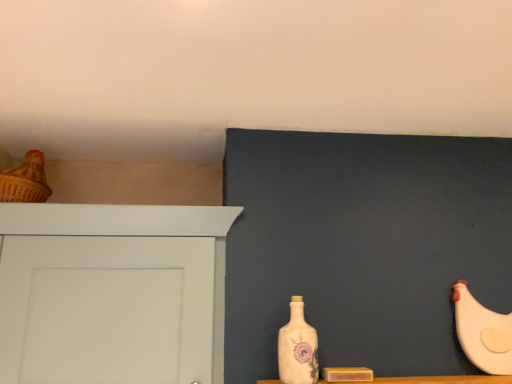
How much space does matte brown chicken at upper left, acting as the 2th chicken starting from the bottom, occupy horizontally?

6.15 inches.

Locate an element on the screen. white painted wood door at left is located at coordinates (110, 292).

You are a GUI agent. You are given a task and a screenshot of the screen. Output one action in this format:
    pyautogui.click(x=<x>, y=<y>)
    Task: Click on the matte brown chicken at upper left, arranged as the 2th chicken when viewed from the right
    
    Given the screenshot: What is the action you would take?
    pyautogui.click(x=25, y=181)

Looking at this image, considering the sizes of objects porcelain floral bottle at center and white painted wood door at left in the image provided, who is taller, porcelain floral bottle at center or white painted wood door at left?

Standing taller between the two is white painted wood door at left.

In the scene shown: Considering the relative positions of porcelain floral bottle at center and white painted wood door at left in the image provided, is porcelain floral bottle at center to the left or to the right of white painted wood door at left?

porcelain floral bottle at center is positioned on white painted wood door at left's right side.

From the image's perspective, relative to white painted wood door at left, is porcelain floral bottle at center above or below?

porcelain floral bottle at center is below white painted wood door at left.

In the scene shown: Is the surface of matte brown chicken at upper left, acting as the 2th chicken starting from the bottom, in direct contact with white matte chicken at right, the 2th chicken in the top-to-bottom sequence?

No.

Looking at this image, from the image's perspective, does matte brown chicken at upper left, acting as the 2th chicken starting from the bottom, appear higher than white matte chicken at right, which is the 1th chicken in right-to-left order?

Indeed, from the image's perspective, matte brown chicken at upper left, acting as the 2th chicken starting from the bottom, is shown above white matte chicken at right, which is the 1th chicken in right-to-left order.

This screenshot has width=512, height=384. I want to click on chicken that is on the right side of matte brown chicken at upper left, arranged as the 2th chicken when viewed from the right, so click(x=482, y=332).

How different are the orientations of matte brown chicken at upper left, arranged as the 2th chicken when viewed from the right, and white matte chicken at right, arranged as the first chicken when ordered from the bottom, in degrees?

0.49 degrees separate the facing orientations of matte brown chicken at upper left, arranged as the 2th chicken when viewed from the right, and white matte chicken at right, arranged as the first chicken when ordered from the bottom.

From a real-world perspective, is white matte chicken at right, which is the 1th chicken in right-to-left order, physically located above or below matte brown chicken at upper left, arranged as the 2th chicken when viewed from the right?

white matte chicken at right, which is the 1th chicken in right-to-left order, is below matte brown chicken at upper left, arranged as the 2th chicken when viewed from the right.

Which is nearer, [495,366] or [26,197]?

Positioned in front is point [495,366].

Would you say white matte chicken at right, arranged as the first chicken when ordered from the bottom, is a long distance from matte brown chicken at upper left, which appears as the 1th chicken when viewed from the top?

Absolutely, white matte chicken at right, arranged as the first chicken when ordered from the bottom, is distant from matte brown chicken at upper left, which appears as the 1th chicken when viewed from the top.

Is porcelain floral bottle at center oriented away from matte brown chicken at upper left, arranged as the 2th chicken when viewed from the right?

No.

Considering the relative sizes of porcelain floral bottle at center and matte brown chicken at upper left, acting as the 2th chicken starting from the bottom, in the image provided, is porcelain floral bottle at center bigger than matte brown chicken at upper left, acting as the 2th chicken starting from the bottom,?

Actually, porcelain floral bottle at center might be smaller than matte brown chicken at upper left, acting as the 2th chicken starting from the bottom.

From the image's perspective, is porcelain floral bottle at center under matte brown chicken at upper left, which appears as the 1th chicken when viewed from the top?

Indeed, from the image's perspective, porcelain floral bottle at center is shown beneath matte brown chicken at upper left, which appears as the 1th chicken when viewed from the top.

Looking at this image, who is taller, porcelain floral bottle at center or matte brown chicken at upper left, which ranks as the 1th chicken in left-to-right order?

Standing taller between the two is porcelain floral bottle at center.

From the image's perspective, between white matte chicken at right, the 2th chicken in the top-to-bottom sequence, and white painted wood door at left, which one is located above?

white painted wood door at left appears higher in the image.

This screenshot has width=512, height=384. I want to click on the 1st chicken behind when counting from the white painted wood door at left, so click(482, 332).

Is white matte chicken at right, arranged as the first chicken when ordered from the bottom, to the right of white painted wood door at left from the viewer's perspective?

Yes.

Could porcelain floral bottle at center be considered to be inside matte brown chicken at upper left, which ranks as the 1th chicken in left-to-right order?

No, porcelain floral bottle at center is located outside of matte brown chicken at upper left, which ranks as the 1th chicken in left-to-right order.

Where is `the 2nd chicken directly above the porcelain floral bottle at center (from a real-world perspective)`? the 2nd chicken directly above the porcelain floral bottle at center (from a real-world perspective) is located at coordinates (25, 181).

Does matte brown chicken at upper left, which appears as the 1th chicken when viewed from the top, come in front of porcelain floral bottle at center?

No, matte brown chicken at upper left, which appears as the 1th chicken when viewed from the top, is further to the viewer.

Can you confirm if matte brown chicken at upper left, acting as the 2th chicken starting from the bottom, is positioned to the left of porcelain floral bottle at center?

Yes, matte brown chicken at upper left, acting as the 2th chicken starting from the bottom, is to the left of porcelain floral bottle at center.

From the picture: Is the position of white painted wood door at left more distant than that of white matte chicken at right, arranged as the first chicken when ordered from the bottom?

No, white painted wood door at left is closer to the camera.

Who is bigger, white painted wood door at left or white matte chicken at right, marked as the second chicken in a left-to-right arrangement?

With larger size is white painted wood door at left.

Who is taller, white painted wood door at left or white matte chicken at right, which is the 1th chicken in right-to-left order?

white painted wood door at left.

Which point is more forward, (42, 236) or (467, 343)?

The point (42, 236) is in front.

The image size is (512, 384). Find the location of `door that appears in front of the porcelain floral bottle at center`. door that appears in front of the porcelain floral bottle at center is located at coordinates (110, 292).

Locate an element on the screen. chicken above the white matte chicken at right, arranged as the first chicken when ordered from the bottom (from the image's perspective) is located at coordinates (25, 181).

From the image, which object appears to be farther from white matte chicken at right, arranged as the first chicken when ordered from the bottom, white painted wood door at left or porcelain floral bottle at center?

white painted wood door at left lies further to white matte chicken at right, arranged as the first chicken when ordered from the bottom, than the other object.

When comparing their distances from white painted wood door at left, does matte brown chicken at upper left, which ranks as the 1th chicken in left-to-right order, or white matte chicken at right, marked as the second chicken in a left-to-right arrangement, seem further?

The object further to white painted wood door at left is white matte chicken at right, marked as the second chicken in a left-to-right arrangement.

From the image, which object appears to be nearer to white matte chicken at right, arranged as the first chicken when ordered from the bottom, porcelain floral bottle at center or white painted wood door at left?

Among the two, porcelain floral bottle at center is located nearer to white matte chicken at right, arranged as the first chicken when ordered from the bottom.

When comparing their distances from porcelain floral bottle at center, does white matte chicken at right, which is the 1th chicken in right-to-left order, or white painted wood door at left seem further?

Based on the image, white matte chicken at right, which is the 1th chicken in right-to-left order, appears to be further to porcelain floral bottle at center.

When comparing their distances from matte brown chicken at upper left, acting as the 2th chicken starting from the bottom, does white painted wood door at left or porcelain floral bottle at center seem closer?

white painted wood door at left is positioned closer to the anchor matte brown chicken at upper left, acting as the 2th chicken starting from the bottom.

Looking at the image, which one is located further to matte brown chicken at upper left, acting as the 2th chicken starting from the bottom, porcelain floral bottle at center or white matte chicken at right, the 2th chicken in the top-to-bottom sequence?

Among the two, white matte chicken at right, the 2th chicken in the top-to-bottom sequence, is located further to matte brown chicken at upper left, acting as the 2th chicken starting from the bottom.

When comparing their distances from porcelain floral bottle at center, does white painted wood door at left or matte brown chicken at upper left, which ranks as the 1th chicken in left-to-right order, seem further?

matte brown chicken at upper left, which ranks as the 1th chicken in left-to-right order, lies further to porcelain floral bottle at center than the other object.

From the picture: Which object lies further to the anchor point white painted wood door at left, white matte chicken at right, the 2th chicken in the top-to-bottom sequence, or porcelain floral bottle at center?

→ white matte chicken at right, the 2th chicken in the top-to-bottom sequence, lies further to white painted wood door at left than the other object.

At what (x,y) coordinates should I click in order to perform the action: click on door between matte brown chicken at upper left, acting as the 2th chicken starting from the bottom, and white matte chicken at right, which is the 1th chicken in right-to-left order, from left to right. Please return your answer as a coordinate pair (x, y). This screenshot has width=512, height=384. Looking at the image, I should click on (110, 292).

I want to click on bottle located between matte brown chicken at upper left, which appears as the 1th chicken when viewed from the top, and white matte chicken at right, the 2th chicken in the top-to-bottom sequence, in the left-right direction, so click(298, 348).

This screenshot has height=384, width=512. What are the coordinates of `bottle between white painted wood door at left and white matte chicken at right, marked as the second chicken in a left-to-right arrangement` in the screenshot? It's located at (298, 348).

This screenshot has height=384, width=512. What are the coordinates of `door located between matte brown chicken at upper left, which ranks as the 1th chicken in left-to-right order, and porcelain floral bottle at center in the left-right direction` in the screenshot? It's located at (110, 292).